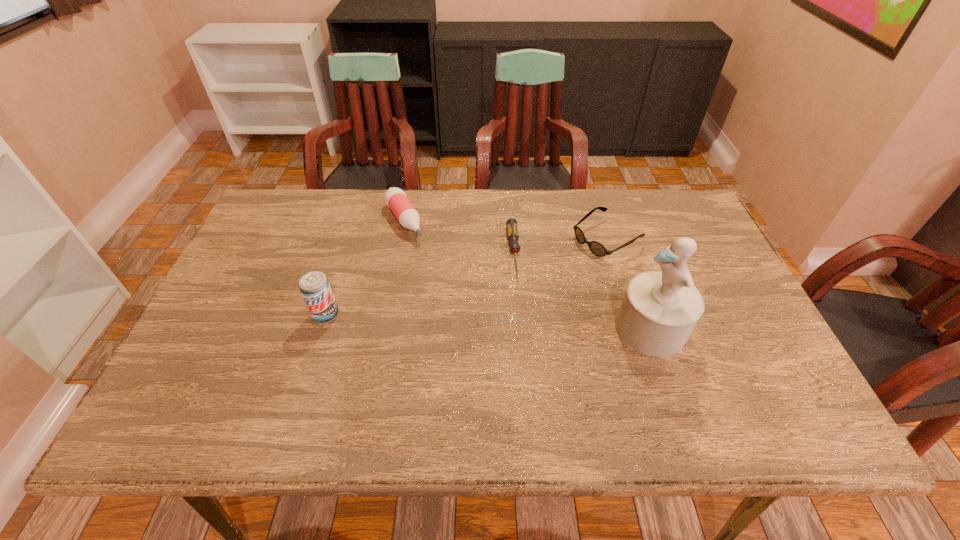
I want to click on free spot on the desktop that is between the beer can and the figurine and is positioned on the lenses of the sunglasses, so click(x=455, y=320).

Locate an element on the screen. free spot on the desktop that is between the beer can and the figurine and is positioned insert the screwdriver into a screw head is located at coordinates (522, 323).

Find the location of a particular element. The image size is (960, 540). free space on the desktop that is between the leftmost object and the tallest object and is positioned with the cap open on the fourth object from right to left is located at coordinates (473, 321).